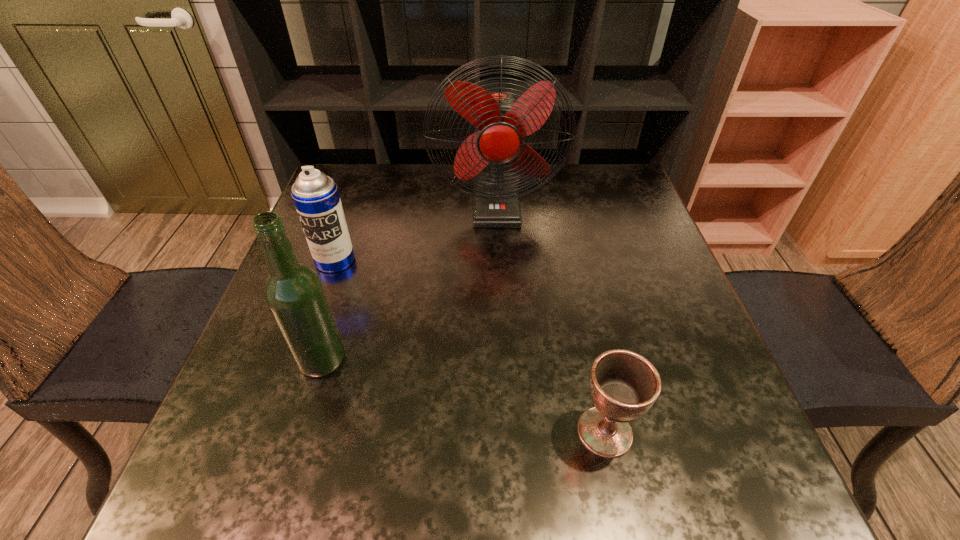
Where is `free region at the far left corner of the desktop`? The image size is (960, 540). free region at the far left corner of the desktop is located at coordinates (335, 164).

What are the coordinates of `vacant space at the far right corner` in the screenshot? It's located at (636, 192).

The width and height of the screenshot is (960, 540). Identify the location of free point between the fan and the second farthest object. pos(416,232).

Identify the location of empty location between the chalice and the liquor. Image resolution: width=960 pixels, height=540 pixels. (464, 396).

At what (x,y) coordinates should I click in order to perform the action: click on blank region between the nearest object and the second shortest object. Please return your answer as a coordinate pair (x, y). Image resolution: width=960 pixels, height=540 pixels. Looking at the image, I should click on (469, 346).

I want to click on vacant area between the chalice and the liquor, so click(x=464, y=396).

This screenshot has height=540, width=960. I want to click on vacant area that lies between the nearest object and the tallest object, so click(550, 318).

Image resolution: width=960 pixels, height=540 pixels. I want to click on vacant space that is in between the fan and the chalice, so click(550, 318).

Find the location of `free space between the second tallest object and the shortest object`. free space between the second tallest object and the shortest object is located at coordinates (464, 396).

Identify the location of vacant space that's between the farthest object and the second tallest object. The height and width of the screenshot is (540, 960). (409, 282).